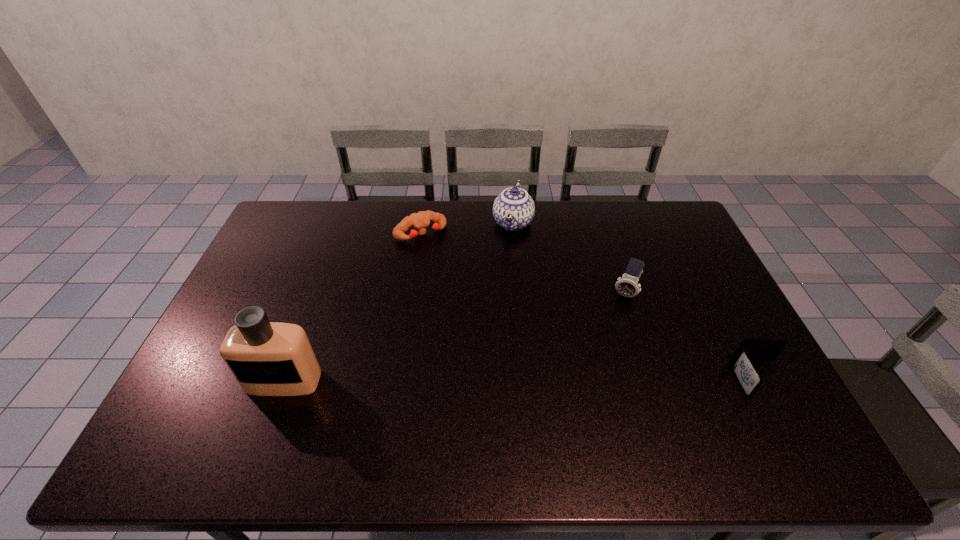
Where is `vacant space located 0.210m from the spout of the chinaware`? This screenshot has height=540, width=960. vacant space located 0.210m from the spout of the chinaware is located at coordinates (494, 284).

Where is `vacant space located 0.050m on the face of the third tallest object`? Image resolution: width=960 pixels, height=540 pixels. vacant space located 0.050m on the face of the third tallest object is located at coordinates (616, 316).

Where is `vacant area situated on the face of the third tallest object`? The image size is (960, 540). vacant area situated on the face of the third tallest object is located at coordinates (610, 333).

This screenshot has height=540, width=960. Identify the location of free space located 0.110m on the face of the third tallest object. (611, 330).

I want to click on vacant space located with the gloves of the puncher facing forward, so click(447, 268).

I want to click on blank area located with the gloves of the puncher facing forward, so click(x=454, y=278).

Locate an element on the screen. This screenshot has height=540, width=960. vacant space located 0.390m with the gloves of the puncher facing forward is located at coordinates (483, 319).

Where is `chinaware that is at the far edge`? This screenshot has width=960, height=540. chinaware that is at the far edge is located at coordinates (513, 209).

The image size is (960, 540). I want to click on puncher located at the far edge, so click(419, 221).

This screenshot has width=960, height=540. Find the location of `perfume that is at the near edge`. perfume that is at the near edge is located at coordinates (267, 358).